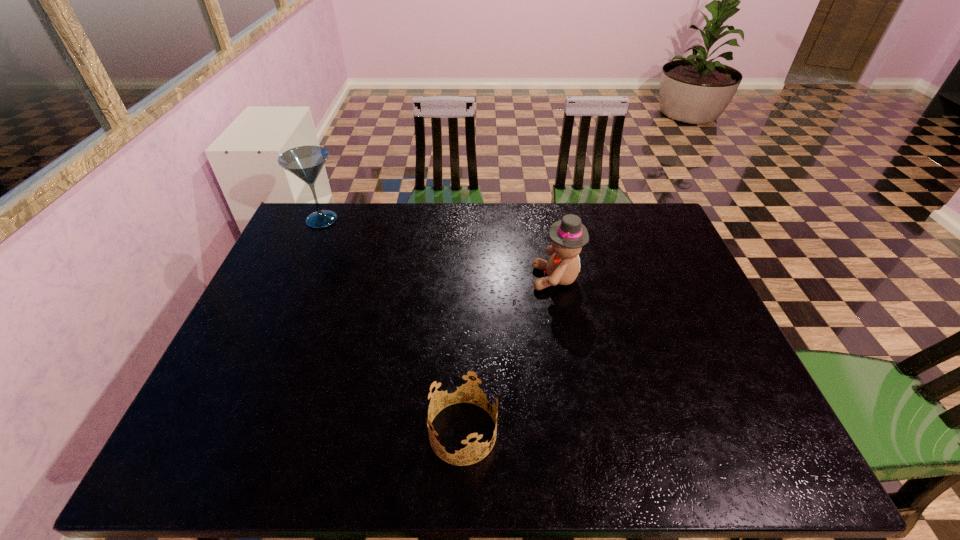
You are a GUI agent. You are given a task and a screenshot of the screen. Output one action in this format:
    pyautogui.click(x=<x>, y=<y>)
    Task: Click on the closest object to the rightmost object
    The image size is (960, 540).
    Given the screenshot: What is the action you would take?
    pyautogui.click(x=461, y=386)

Find the location of a particular element. The width and height of the screenshot is (960, 540). free location that satisfies the following two spatial constraints: 1. on the front side of the farthest object; 2. on the left side of the crown is located at coordinates (227, 433).